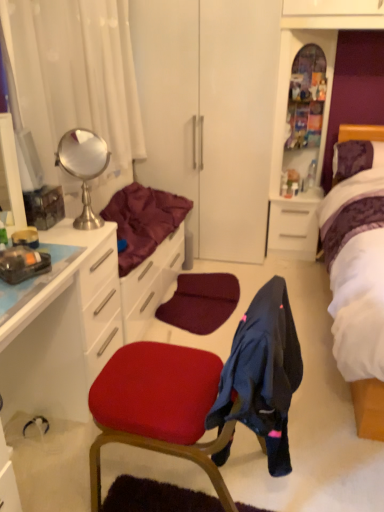
At what (x,y) coordinates should I click in order to perform the action: click on free spot above white glossy file cabinet at center right, the 2th file cabinet when ordered from top to bottom (from a real-world perspective). Please return your answer as a coordinate pair (x, y). The image size is (384, 512). Looking at the image, I should click on (300, 193).